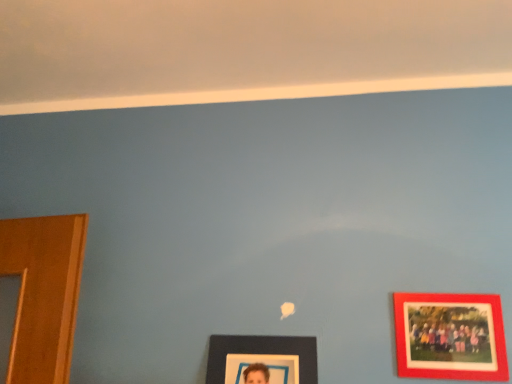
What do you see at coordinates (450, 336) in the screenshot? This screenshot has width=512, height=384. I see `red matte picture frame at right, which is the second picture frame from left to right` at bounding box center [450, 336].

At what (x,y) coordinates should I click in order to perform the action: click on red matte picture frame at right, which is the second picture frame from left to right. Please return your answer as a coordinate pair (x, y). The image size is (512, 384). Looking at the image, I should click on (450, 336).

What do you see at coordinates (262, 358) in the screenshot?
I see `matte black picture frame at lower center, which is the 2th picture frame in right-to-left order` at bounding box center [262, 358].

Image resolution: width=512 pixels, height=384 pixels. In order to click on matte black picture frame at lower center, which is the 2th picture frame in right-to-left order in this screenshot , I will do `click(262, 358)`.

You are a GUI agent. You are given a task and a screenshot of the screen. Output one action in this format:
    pyautogui.click(x=<x>, y=<y>)
    Task: Click on the red matte picture frame at right, the first picture frame from the right
    
    Given the screenshot: What is the action you would take?
    450,336

Is red matte picture frame at right, the first picture frame from the right, to the left or to the right of matte black picture frame at lower center, the first picture frame viewed from the left, in the image?

red matte picture frame at right, the first picture frame from the right, is to the right of matte black picture frame at lower center, the first picture frame viewed from the left.

Is red matte picture frame at right, which is the second picture frame from left to right, in front of or behind matte black picture frame at lower center, the first picture frame viewed from the left, in the image?

Visually, red matte picture frame at right, which is the second picture frame from left to right, is located behind matte black picture frame at lower center, the first picture frame viewed from the left.

Which point is more distant from viewer, (464, 362) or (226, 364)?

Positioned behind is point (226, 364).

From the image's perspective, is red matte picture frame at right, which is the second picture frame from left to right, located above or below matte black picture frame at lower center, which is the 2th picture frame in right-to-left order?

red matte picture frame at right, which is the second picture frame from left to right, is situated higher than matte black picture frame at lower center, which is the 2th picture frame in right-to-left order, in the image.

From a real-world perspective, between red matte picture frame at right, the first picture frame from the right, and matte black picture frame at lower center, the first picture frame viewed from the left, who is vertically lower?

matte black picture frame at lower center, the first picture frame viewed from the left, from a real-world perspective.

Considering the sizes of objects red matte picture frame at right, the first picture frame from the right, and matte black picture frame at lower center, which is the 2th picture frame in right-to-left order, in the image provided, who is thinner, red matte picture frame at right, the first picture frame from the right, or matte black picture frame at lower center, which is the 2th picture frame in right-to-left order,?

With smaller width is red matte picture frame at right, the first picture frame from the right.

Does red matte picture frame at right, the first picture frame from the right, have a lesser height compared to matte black picture frame at lower center, which is the 2th picture frame in right-to-left order?

Yes, red matte picture frame at right, the first picture frame from the right, is shorter than matte black picture frame at lower center, which is the 2th picture frame in right-to-left order.

Does red matte picture frame at right, the first picture frame from the right, have a larger size compared to matte black picture frame at lower center, which is the 2th picture frame in right-to-left order?

No, red matte picture frame at right, the first picture frame from the right, is not bigger than matte black picture frame at lower center, which is the 2th picture frame in right-to-left order.

Is red matte picture frame at right, the first picture frame from the right, spatially inside matte black picture frame at lower center, the first picture frame viewed from the left, or outside of it?

red matte picture frame at right, the first picture frame from the right, exists outside the volume of matte black picture frame at lower center, the first picture frame viewed from the left.

In the scene shown: Is red matte picture frame at right, which is the second picture frame from left to right, directly adjacent to matte black picture frame at lower center, the first picture frame viewed from the left?

There is a gap between red matte picture frame at right, which is the second picture frame from left to right, and matte black picture frame at lower center, the first picture frame viewed from the left.

Could you tell me if red matte picture frame at right, the first picture frame from the right, is turned towards matte black picture frame at lower center, the first picture frame viewed from the left?

No, red matte picture frame at right, the first picture frame from the right, is not oriented towards matte black picture frame at lower center, the first picture frame viewed from the left.

How many degrees apart are the facing directions of red matte picture frame at right, which is the second picture frame from left to right, and matte black picture frame at lower center, the first picture frame viewed from the left?

0.262 degrees.

Where is `picture frame in front of the red matte picture frame at right, the first picture frame from the right`? The height and width of the screenshot is (384, 512). picture frame in front of the red matte picture frame at right, the first picture frame from the right is located at coordinates (262, 358).

Considering the positions of objects matte black picture frame at lower center, which is the 2th picture frame in right-to-left order, and red matte picture frame at right, which is the second picture frame from left to right, in the image provided, who is more to the right, matte black picture frame at lower center, which is the 2th picture frame in right-to-left order, or red matte picture frame at right, which is the second picture frame from left to right,?

red matte picture frame at right, which is the second picture frame from left to right.

Between matte black picture frame at lower center, which is the 2th picture frame in right-to-left order, and red matte picture frame at right, the first picture frame from the right, which one is positioned behind?

red matte picture frame at right, the first picture frame from the right, is further away from the camera.

Does point (261, 344) come closer to viewer compared to point (495, 367)?

No.

From the image's perspective, which one is positioned higher, matte black picture frame at lower center, the first picture frame viewed from the left, or red matte picture frame at right, the first picture frame from the right?

From the image's view, red matte picture frame at right, the first picture frame from the right, is above.

From a real-world perspective, is matte black picture frame at lower center, the first picture frame viewed from the left, on top of red matte picture frame at right, the first picture frame from the right?

Actually, matte black picture frame at lower center, the first picture frame viewed from the left, is physically below red matte picture frame at right, the first picture frame from the right, in the real world.

In the scene shown: Between matte black picture frame at lower center, which is the 2th picture frame in right-to-left order, and red matte picture frame at right, which is the second picture frame from left to right, which one has larger width?

Wider between the two is matte black picture frame at lower center, which is the 2th picture frame in right-to-left order.

From their relative heights in the image, would you say matte black picture frame at lower center, the first picture frame viewed from the left, is taller or shorter than red matte picture frame at right, which is the second picture frame from left to right?

Clearly, matte black picture frame at lower center, the first picture frame viewed from the left, is taller compared to red matte picture frame at right, which is the second picture frame from left to right.

Which of these two, matte black picture frame at lower center, the first picture frame viewed from the left, or red matte picture frame at right, which is the second picture frame from left to right, is smaller?

Smaller between the two is red matte picture frame at right, which is the second picture frame from left to right.

Is matte black picture frame at lower center, which is the 2th picture frame in right-to-left order, inside or outside of red matte picture frame at right, which is the second picture frame from left to right?

matte black picture frame at lower center, which is the 2th picture frame in right-to-left order, is outside red matte picture frame at right, which is the second picture frame from left to right.

Would you consider matte black picture frame at lower center, which is the 2th picture frame in right-to-left order, to be distant from red matte picture frame at right, which is the second picture frame from left to right?

No, matte black picture frame at lower center, which is the 2th picture frame in right-to-left order, is not far away from red matte picture frame at right, which is the second picture frame from left to right.

Is matte black picture frame at lower center, the first picture frame viewed from the left, facing towards red matte picture frame at right, which is the second picture frame from left to right?

No, matte black picture frame at lower center, the first picture frame viewed from the left, is not oriented towards red matte picture frame at right, which is the second picture frame from left to right.

How different are the orientations of matte black picture frame at lower center, which is the 2th picture frame in right-to-left order, and red matte picture frame at right, the first picture frame from the right, in degrees?

There is a 0.262-degree angle between the facing directions of matte black picture frame at lower center, which is the 2th picture frame in right-to-left order, and red matte picture frame at right, the first picture frame from the right.

Find the location of a particular element. This screenshot has width=512, height=384. picture frame on the left of the red matte picture frame at right, the first picture frame from the right is located at coordinates (262, 358).

At what (x,y) coordinates should I click in order to perform the action: click on picture frame to the left of red matte picture frame at right, which is the second picture frame from left to right. Please return your answer as a coordinate pair (x, y). This screenshot has width=512, height=384. Looking at the image, I should click on (262, 358).

This screenshot has height=384, width=512. What are the coordinates of `picture frame above the matte black picture frame at lower center, the first picture frame viewed from the left (from the image's perspective)` in the screenshot? It's located at (450, 336).